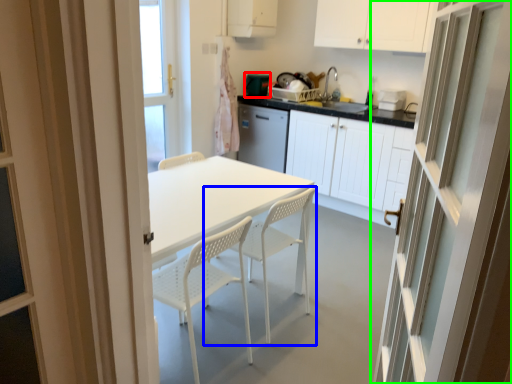
Question: Which is farther away from appliance (highlighted by a red box)? chair (highlighted by a blue box) or door (highlighted by a green box)?

Choices:
 (A) chair
 (B) door

Answer: (B)